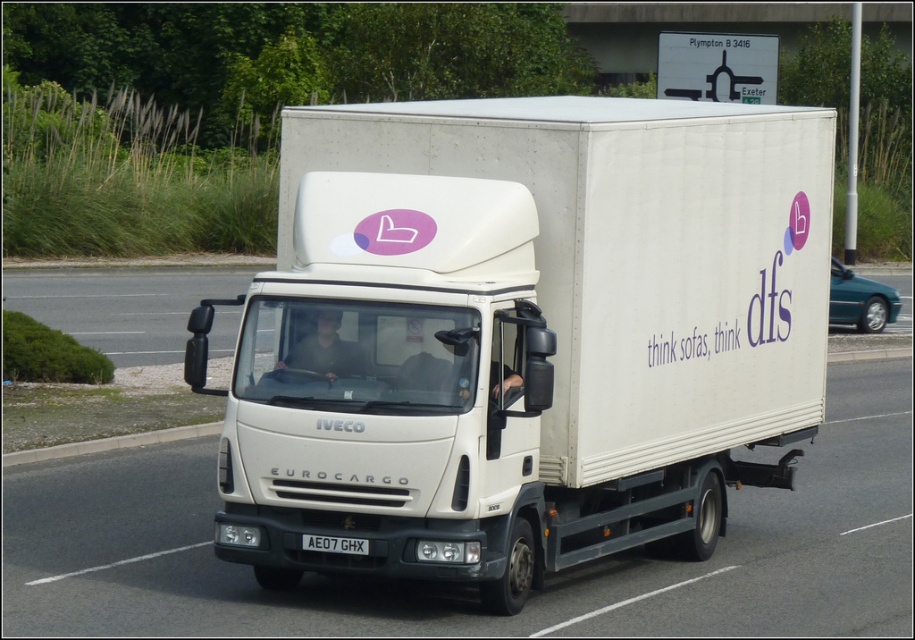
Question: Among these points, which one is farthest from the camera?

Choices:
 (A) (770, 154)
 (B) (300, 541)

Answer: (A)

Question: From the image, what is the correct spatial relationship of white matte truck at center in relation to white plastic license plate at center?

Choices:
 (A) right
 (B) left

Answer: (A)

Question: In this image, where is white matte truck at center located relative to white plastic license plate at center?

Choices:
 (A) below
 (B) above

Answer: (A)

Question: Does white matte truck at center appear on the right side of white plastic license plate at center?

Choices:
 (A) no
 (B) yes

Answer: (B)